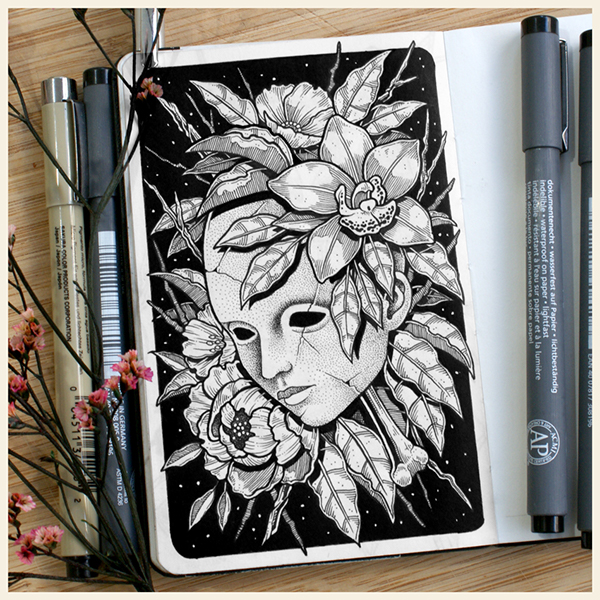
This screenshot has height=600, width=600. What are the coordinates of `pen` in the screenshot? It's located at (71, 232), (98, 245), (554, 275), (584, 299).